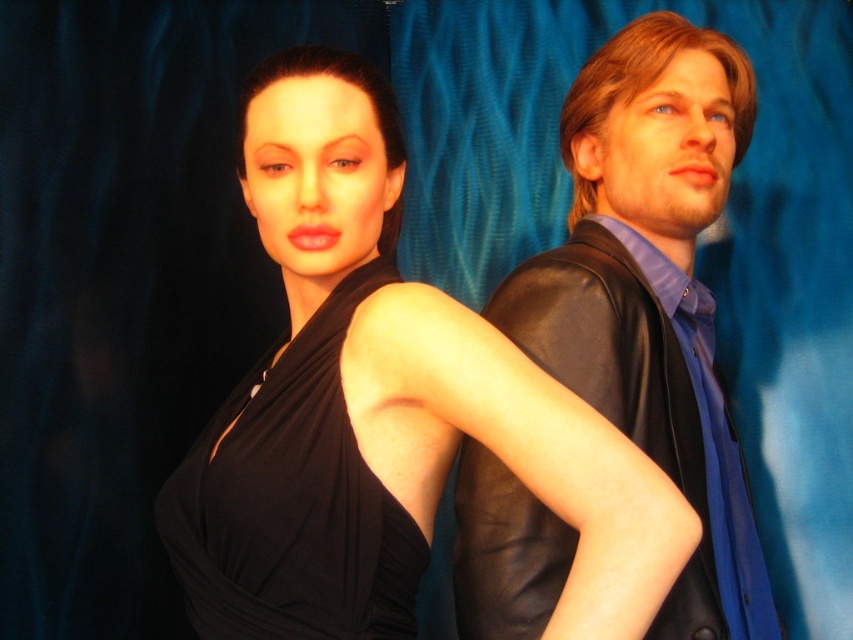
Question: Is black matte dress at center further to camera compared to black satin dress at upper left?

Choices:
 (A) yes
 (B) no

Answer: (B)

Question: Which object is the farthest from the black matte dress at center?

Choices:
 (A) black satin dress at upper left
 (B) leather jacket at right

Answer: (B)

Question: Is black matte dress at center closer to camera compared to leather jacket at right?

Choices:
 (A) yes
 (B) no

Answer: (A)

Question: Which point is farther to the camera?

Choices:
 (A) (415, 561)
 (B) (614, 273)

Answer: (B)

Question: Is black matte dress at center further to the viewer compared to leather jacket at right?

Choices:
 (A) no
 (B) yes

Answer: (A)

Question: Which object is the closest to the leather jacket at right?

Choices:
 (A) black matte dress at center
 (B) black satin dress at upper left

Answer: (A)